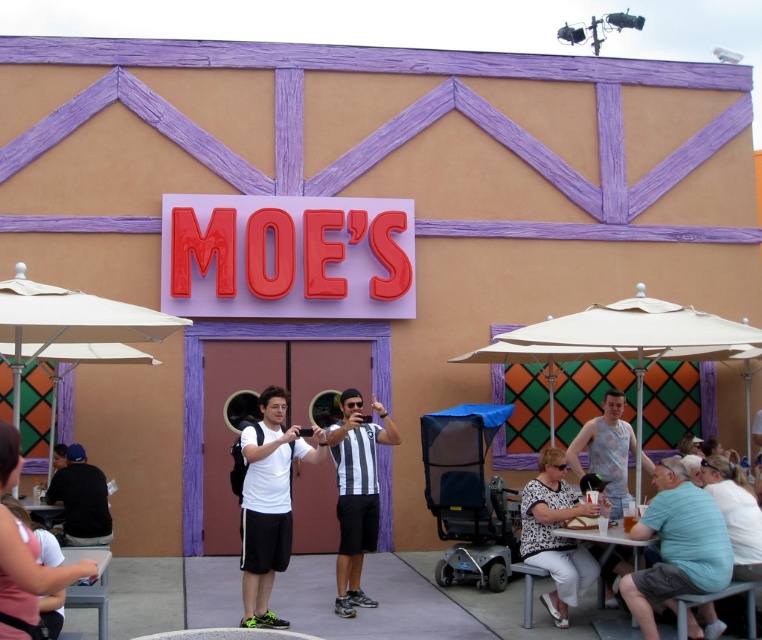
Question: Can you confirm if white fabric umbrella at right is bigger than striped jersey at center?

Choices:
 (A) no
 (B) yes

Answer: (B)

Question: Observing the image, what is the correct spatial positioning of white fabric umbrella at left in reference to striped jersey at center?

Choices:
 (A) right
 (B) left

Answer: (B)

Question: Which of the following is the closest to the observer?

Choices:
 (A) (285, 449)
 (B) (572, 596)

Answer: (B)

Question: From the image, what is the correct spatial relationship of light blue t-shirt at lower right in relation to black shirt at lower left?

Choices:
 (A) above
 (B) below

Answer: (A)

Question: Which of these objects is positioned farthest from the white matte t-shirt at center?

Choices:
 (A) light blue t-shirt at lower right
 (B) dark blue shirt at lower left

Answer: (B)

Question: Which point is farther to the camera?

Choices:
 (A) (66, 522)
 (B) (351, 483)
 (C) (143, 308)
 (D) (575, 316)

Answer: (A)